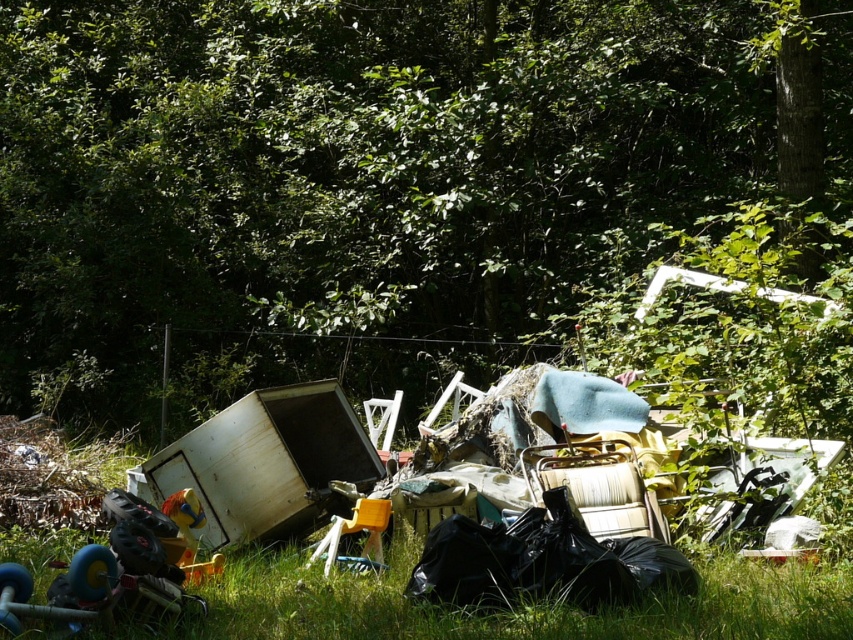
You are a gardener trying to plant a new sapling in the green grass at lower center. Would the green leafy tree at upper center block sunlight from reaching the sapling?

The green leafy tree at upper center is positioned over green grass at lower center, so it would block sunlight from reaching the sapling planted there.

You are standing in the middle of the grassy area surrounded by discarded items. You see two points marked in the scene. Which point is closer to you, point (277, 216) or point (463, 564)?

Point (277, 216) is closer to you because it is further to the viewer than point (463, 564).